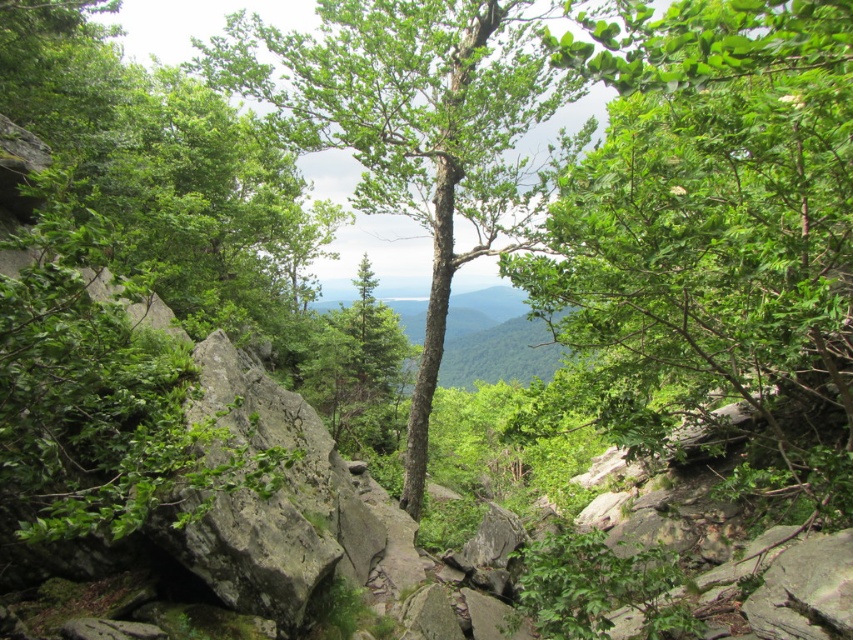
Question: Does green leafy tree at center appear under green rough bark tree at center?

Choices:
 (A) yes
 (B) no

Answer: (A)

Question: Does green leafy tree at center have a larger size compared to green rough bark tree at center?

Choices:
 (A) yes
 (B) no

Answer: (B)

Question: Which point is closer to the camera?

Choices:
 (A) (648, 10)
 (B) (491, 170)

Answer: (A)

Question: In this image, where is green leafy tree at center located relative to green rough bark tree at center?

Choices:
 (A) below
 (B) above

Answer: (A)